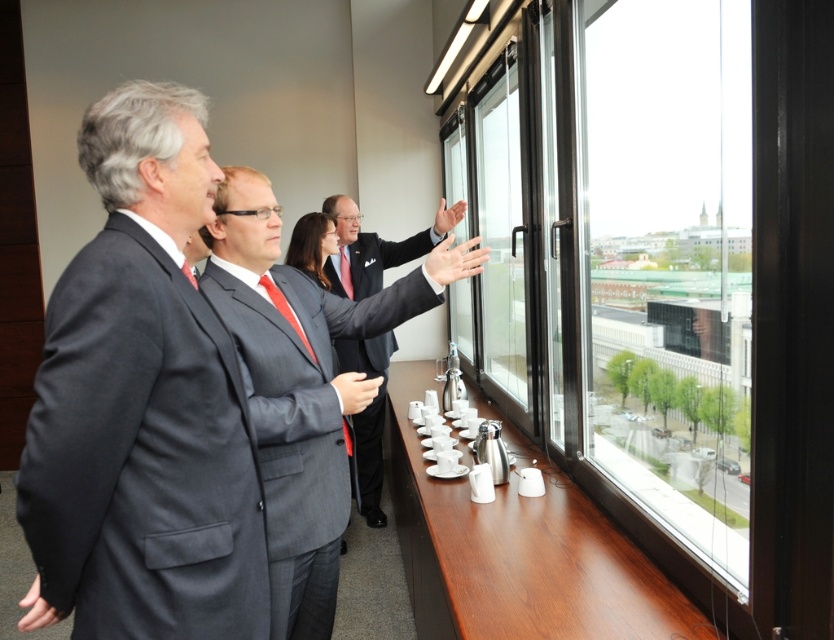
Question: Is transparent glass window at right to the right of dark gray suit at center from the viewer's perspective?

Choices:
 (A) no
 (B) yes

Answer: (B)

Question: Can you confirm if dark gray suit at left is positioned to the left of transparent glass window at right?

Choices:
 (A) yes
 (B) no

Answer: (A)

Question: Which point appears farthest from the camera in this image?

Choices:
 (A) (345, 353)
 (B) (596, 176)

Answer: (A)

Question: Is transparent glass window at right thinner than matte gray suit at center?

Choices:
 (A) yes
 (B) no

Answer: (A)

Question: Which object appears closest to the camera in this image?

Choices:
 (A) dark gray suit at left
 (B) transparent glass window at right

Answer: (A)

Question: Which point is farther to the camera?

Choices:
 (A) (448, 262)
 (B) (153, 509)
 (C) (389, 346)
 (D) (731, 493)

Answer: (C)